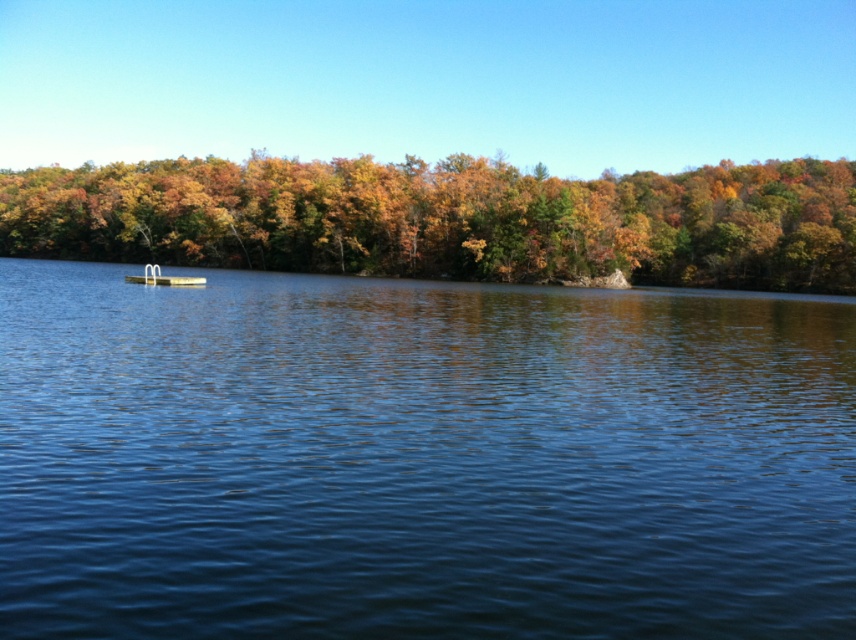
Does green matte tree at upper center have a lesser height compared to white plastic boat at center?

In fact, green matte tree at upper center may be taller than white plastic boat at center.

Can you confirm if green matte tree at upper center is positioned below white plastic boat at center?

Actually, green matte tree at upper center is above white plastic boat at center.

Who is more forward, (x=688, y=218) or (x=185, y=278)?

Point (x=185, y=278)

Image resolution: width=856 pixels, height=640 pixels. I want to click on green matte tree at upper center, so click(x=447, y=220).

Is blue water at center in front of white plastic boat at center?

Yes, it is.

Is point (253, 550) positioned in front of point (150, 280)?

Yes, point (253, 550) is in front of point (150, 280).

The height and width of the screenshot is (640, 856). Find the location of `blue water at center`. blue water at center is located at coordinates (420, 458).

The height and width of the screenshot is (640, 856). I want to click on blue water at center, so click(420, 458).

Does point (498, 336) come closer to viewer compared to point (450, 161)?

Yes, it is.

Locate an element on the screen. This screenshot has width=856, height=640. blue water at center is located at coordinates (420, 458).